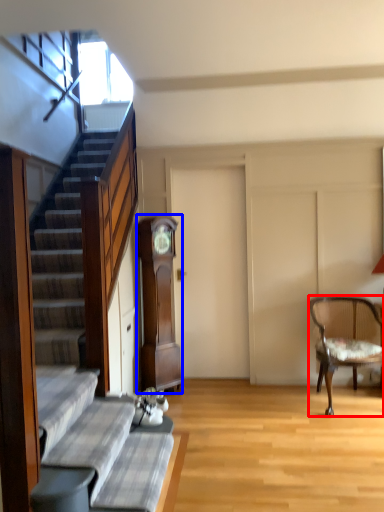
Question: Which of the following is the farthest to the observer, chair (highlighted by a red box) or cabinetry (highlighted by a blue box)?

Choices:
 (A) chair
 (B) cabinetry

Answer: (B)